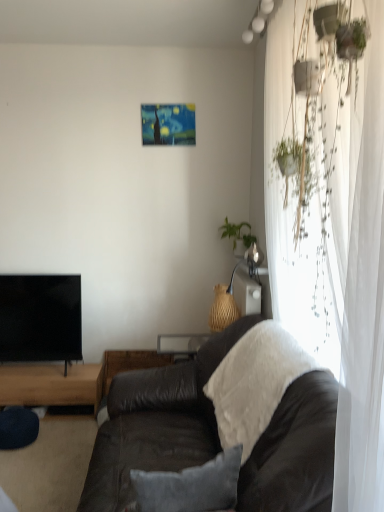
Question: Can you confirm if black glossy tv at left is taller than green leafy plant at upper right?

Choices:
 (A) no
 (B) yes

Answer: (B)

Question: Is black glossy tv at left far away from green leafy plant at upper right?

Choices:
 (A) no
 (B) yes

Answer: (B)

Question: Considering the relative positions of black glossy tv at left and green leafy plant at upper right in the image provided, is black glossy tv at left to the left of green leafy plant at upper right from the viewer's perspective?

Choices:
 (A) yes
 (B) no

Answer: (A)

Question: Can you confirm if black glossy tv at left is positioned to the right of green leafy plant at upper right?

Choices:
 (A) yes
 (B) no

Answer: (B)

Question: Could you tell me if black glossy tv at left is facing green leafy plant at upper right?

Choices:
 (A) yes
 (B) no

Answer: (B)

Question: Considering their positions, is brown wooden table at lower left, which appears as the first table when viewed from the left, located in front of or behind white fluffy blanket at center?

Choices:
 (A) front
 (B) behind

Answer: (B)

Question: Is brown wooden table at lower left, placed as the second table when sorted from right to left, taller or shorter than white fluffy blanket at center?

Choices:
 (A) tall
 (B) short

Answer: (B)

Question: Visually, is brown wooden table at lower left, which appears as the first table when viewed from the left, positioned to the left or to the right of white fluffy blanket at center?

Choices:
 (A) left
 (B) right

Answer: (A)

Question: Is brown wooden table at lower left, which appears as the first table when viewed from the left, bigger or smaller than white fluffy blanket at center?

Choices:
 (A) big
 (B) small

Answer: (B)

Question: From a real-world perspective, is woven wood table at center, the second table in the left-to-right sequence, physically located above or below velvet gray pillow at center?

Choices:
 (A) above
 (B) below

Answer: (B)

Question: Is woven wood table at center, which is counted as the 1th table, starting from the right, taller or shorter than velvet gray pillow at center?

Choices:
 (A) short
 (B) tall

Answer: (B)

Question: Is woven wood table at center, the second table in the left-to-right sequence, inside the boundaries of velvet gray pillow at center, or outside?

Choices:
 (A) inside
 (B) outside

Answer: (B)

Question: Based on their positions, is woven wood table at center, which is counted as the 1th table, starting from the right, located to the left or right of velvet gray pillow at center?

Choices:
 (A) left
 (B) right

Answer: (A)

Question: From the image's perspective, relative to green leafy plant at upper right, is black glossy tv at left above or below?

Choices:
 (A) below
 (B) above

Answer: (A)

Question: Is black glossy tv at left taller or shorter than green leafy plant at upper right?

Choices:
 (A) tall
 (B) short

Answer: (A)